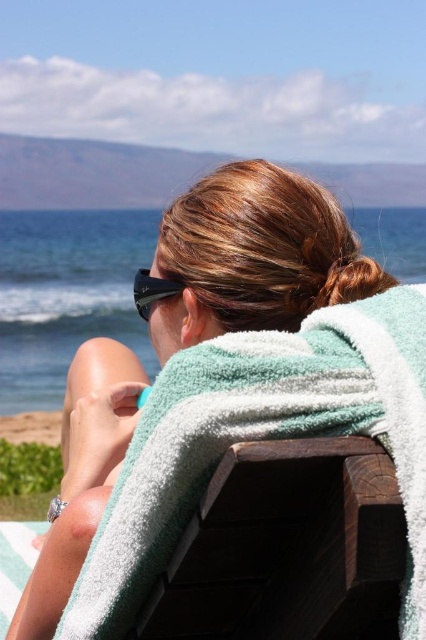
Does green towel at center lie behind black matte sunglasses at center?

That is False.

Is point (170, 324) more distant than point (146, 276)?

That is True.

Does point (195, 186) lie in front of point (178, 289)?

No, it is behind (178, 289).

Locate an element on the screen. This screenshot has height=640, width=426. green towel at center is located at coordinates (253, 257).